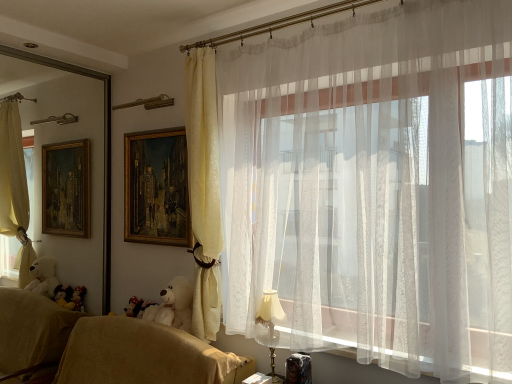
Question: Is white plush bear at lower left not near white sheer curtain at upper right, the 2th curtain from the left?

Choices:
 (A) no
 (B) yes

Answer: (B)

Question: From the image's perspective, is white plush bear at lower left under white sheer curtain at upper right, the 2th curtain from the left?

Choices:
 (A) no
 (B) yes

Answer: (B)

Question: From the image's perspective, is white plush bear at lower left on white sheer curtain at upper right, which is counted as the 1th curtain, starting from the right?

Choices:
 (A) yes
 (B) no

Answer: (B)

Question: From a real-world perspective, is white plush bear at lower left physically above white sheer curtain at upper right, the 2th curtain from the left?

Choices:
 (A) no
 (B) yes

Answer: (A)

Question: Is white plush bear at lower left at the left side of white sheer curtain at upper right, which is counted as the 1th curtain, starting from the right?

Choices:
 (A) no
 (B) yes

Answer: (B)

Question: Relative to white plush bear at lower left, is beige fabric couch at lower left in front or behind?

Choices:
 (A) front
 (B) behind

Answer: (A)

Question: Is beige fabric couch at lower left spatially inside white plush bear at lower left, or outside of it?

Choices:
 (A) inside
 (B) outside

Answer: (B)

Question: From the image's perspective, is beige fabric couch at lower left positioned above or below white plush bear at lower left?

Choices:
 (A) above
 (B) below

Answer: (B)

Question: Based on their positions, is beige fabric couch at lower left located to the left or right of white plush bear at lower left?

Choices:
 (A) left
 (B) right

Answer: (A)

Question: Considering their positions, is matte yellow curtain at center, the first curtain viewed from the left, located in front of or behind matte gold table lamp at lower right?

Choices:
 (A) behind
 (B) front

Answer: (A)

Question: Is point (188, 77) closer or farther from the camera than point (266, 306)?

Choices:
 (A) farther
 (B) closer

Answer: (A)

Question: Is matte yellow curtain at center, which is counted as the second curtain, starting from the right, inside or outside of matte gold table lamp at lower right?

Choices:
 (A) outside
 (B) inside

Answer: (A)

Question: From a real-world perspective, relative to matte gold table lamp at lower right, is matte yellow curtain at center, which is counted as the second curtain, starting from the right, vertically above or below?

Choices:
 (A) below
 (B) above

Answer: (B)

Question: Is beige fabric couch at lower left inside or outside of gold wooden picture frame at upper center?

Choices:
 (A) inside
 (B) outside

Answer: (B)

Question: Would you say beige fabric couch at lower left is to the left or to the right of gold wooden picture frame at upper center in the picture?

Choices:
 (A) right
 (B) left

Answer: (B)